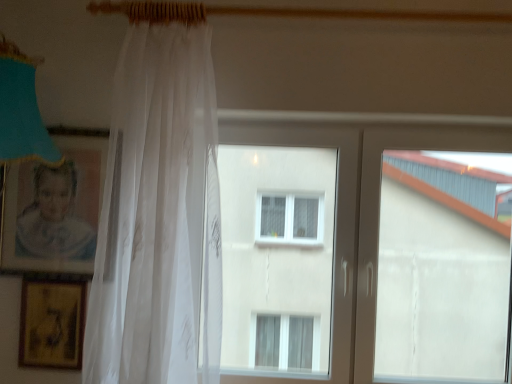
Question: Could you tell me if matte cardboard picture frame at left, placed as the 1th picture frame when sorted from top to bottom, is turned towards translucent white curtain at left?

Choices:
 (A) yes
 (B) no

Answer: (B)

Question: Is matte cardboard picture frame at left, placed as the 1th picture frame when sorted from top to bottom, not near translucent white curtain at left?

Choices:
 (A) yes
 (B) no

Answer: (B)

Question: Would you say matte cardboard picture frame at left, the 2th picture frame in the bottom-to-top sequence, is outside translucent white curtain at left?

Choices:
 (A) no
 (B) yes

Answer: (B)

Question: Is matte cardboard picture frame at left, placed as the 1th picture frame when sorted from top to bottom, thinner than translucent white curtain at left?

Choices:
 (A) no
 (B) yes

Answer: (B)

Question: Is matte cardboard picture frame at left, placed as the 1th picture frame when sorted from top to bottom, to the right of translucent white curtain at left from the viewer's perspective?

Choices:
 (A) yes
 (B) no

Answer: (B)

Question: Would you say white plastic window at center is to the left or to the right of translucent white curtain at left in the picture?

Choices:
 (A) right
 (B) left

Answer: (A)

Question: From the image's perspective, is white plastic window at center above or below translucent white curtain at left?

Choices:
 (A) below
 (B) above

Answer: (A)

Question: Is point (430, 130) closer or farther from the camera than point (139, 268)?

Choices:
 (A) farther
 (B) closer

Answer: (A)

Question: In the image, is white plastic window at center positioned in front of or behind translucent white curtain at left?

Choices:
 (A) behind
 (B) front

Answer: (A)

Question: In terms of height, does matte cardboard picture frame at left, placed as the 1th picture frame when sorted from top to bottom, look taller or shorter compared to translucent white curtain at left?

Choices:
 (A) short
 (B) tall

Answer: (A)

Question: Is matte cardboard picture frame at left, the 2th picture frame in the bottom-to-top sequence, bigger or smaller than translucent white curtain at left?

Choices:
 (A) big
 (B) small

Answer: (B)

Question: Relative to translucent white curtain at left, is matte cardboard picture frame at left, the 2th picture frame in the bottom-to-top sequence, in front or behind?

Choices:
 (A) behind
 (B) front

Answer: (A)

Question: Considering the positions of matte cardboard picture frame at left, the 2th picture frame in the bottom-to-top sequence, and translucent white curtain at left in the image, is matte cardboard picture frame at left, the 2th picture frame in the bottom-to-top sequence, wider or thinner than translucent white curtain at left?

Choices:
 (A) wide
 (B) thin

Answer: (B)

Question: In terms of height, does matte cardboard picture frame at left, placed as the 1th picture frame when sorted from top to bottom, look taller or shorter compared to gold textured picture frame at lower left, the second picture frame from the top?

Choices:
 (A) short
 (B) tall

Answer: (B)

Question: In terms of width, does matte cardboard picture frame at left, placed as the 1th picture frame when sorted from top to bottom, look wider or thinner when compared to gold textured picture frame at lower left, which is counted as the 1th picture frame, starting from the bottom?

Choices:
 (A) wide
 (B) thin

Answer: (A)